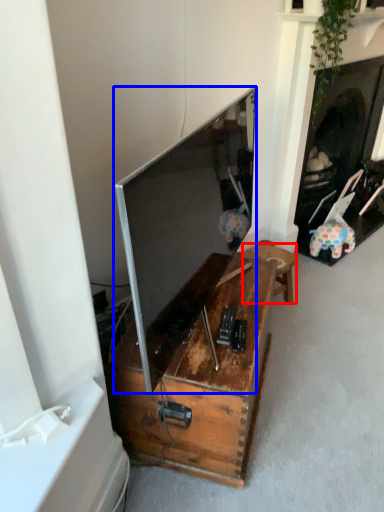
Question: Which point is further to the camera, furniture (highlighted by a red box) or television (highlighted by a blue box)?

Choices:
 (A) furniture
 (B) television

Answer: (A)